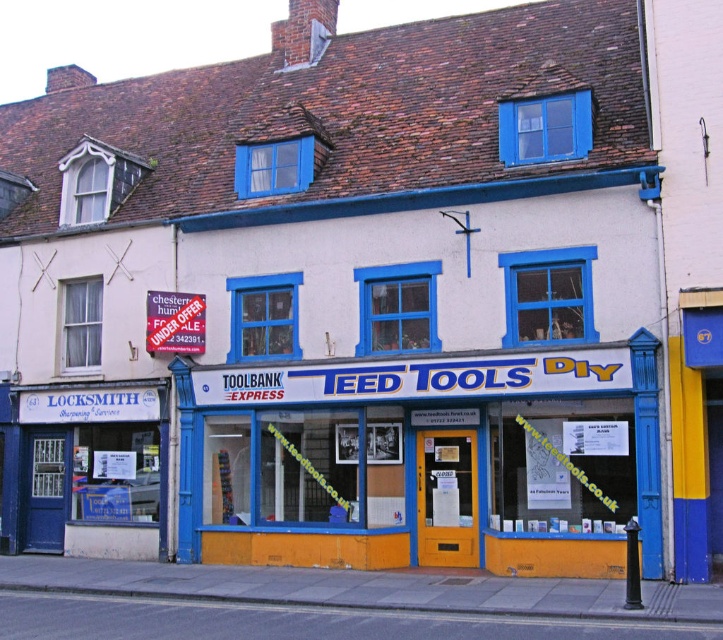
You are a delivery person arriving at TEED TOOLS DIY. You need to enter the building to deliver a package. Which object, the yellow matte door at center or the white plastic sign at upper left, should you use to access the building?

The yellow matte door at center is the correct entry point because it is larger than the white plastic sign at upper left, making it suitable for entering the building.

What is the color of the door located at point [432,460]?

The door at point [432,460] is yellow.

You are a delivery person standing in front of the yellow matte door at center and the white plastic sign at upper left. You need to deliver a package to the TEED TOOLS DIY store. Which object should you interact with to enter the store?

The yellow matte door at center is the entrance to the TEED TOOLS DIY store, so you should interact with the yellow matte door at center to enter the store.